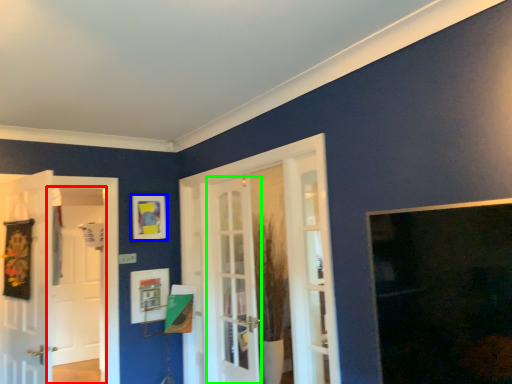
Question: Considering the real-world distances, which object is farthest from screen door (highlighted by a red box)? picture frame (highlighted by a blue box) or door (highlighted by a green box)?

Choices:
 (A) picture frame
 (B) door

Answer: (B)